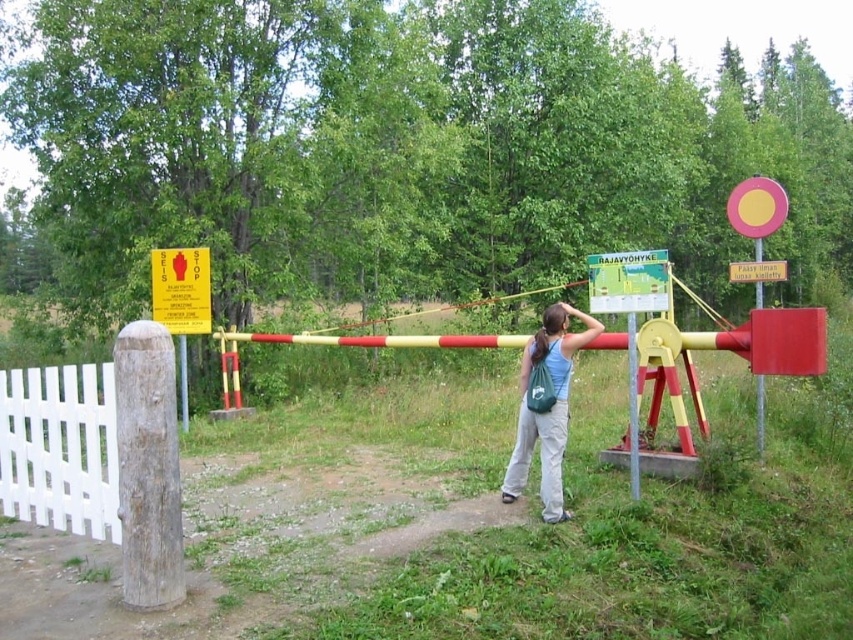
From the picture: You are a delivery person with a cart that is 2 meters wide. You need to navigate through the area between the white wooden fence at left and the brown hair at center. Can your cart fit through this space?

The distance between the white wooden fence at left and the brown hair at center is 3.77 meters. Since the cart is 2 meters wide, it can fit through the space as the distance is wider than the cart.

You are a delivery person trying to navigate through a rural area and need to pass through the gate. You see the metallic pole at center and the brown hair at center. Which object is closer to you as you approach the gate?

Both the metallic pole at center and the brown hair at center are 1.68 meters apart from each other, so they are equidistant from you as you approach the gate.

From the picture: You are a delivery driver approaching the barrier gate and need to stop at the white wooden fence at left and the yellow paper sign at upper left. Which one should you stop at first based on their sizes?

You should stop at the white wooden fence at left first because it has a larger size compared to the yellow paper sign at upper left, meaning it is more prominent and likely requires attention first.